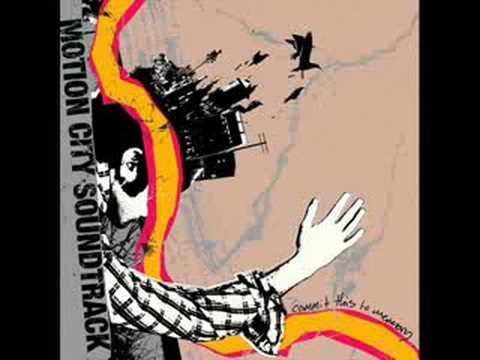
I want to click on cd cover, so click(268, 143).